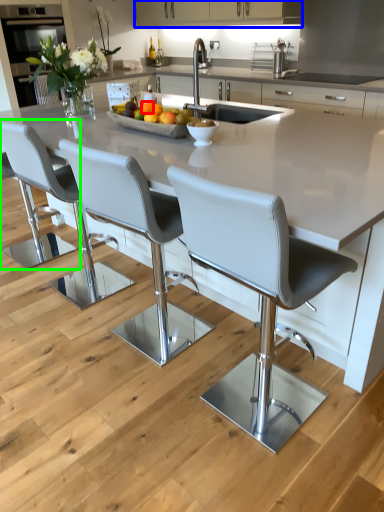
Question: Estimate the real-world distances between objects in this image. Which object is farther from orange (highlighted by a red box), cabinetry (highlighted by a blue box) or chair (highlighted by a green box)?

Choices:
 (A) cabinetry
 (B) chair

Answer: (A)